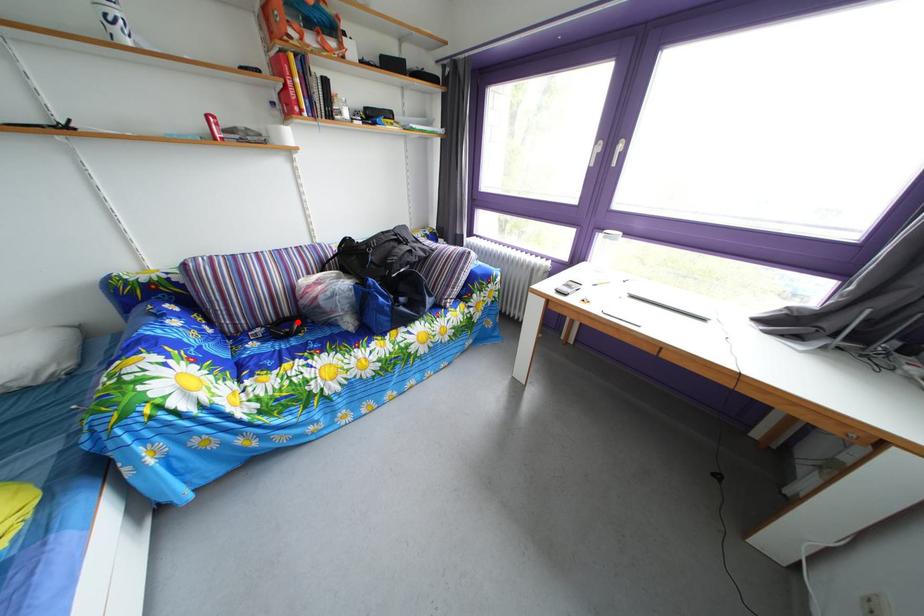
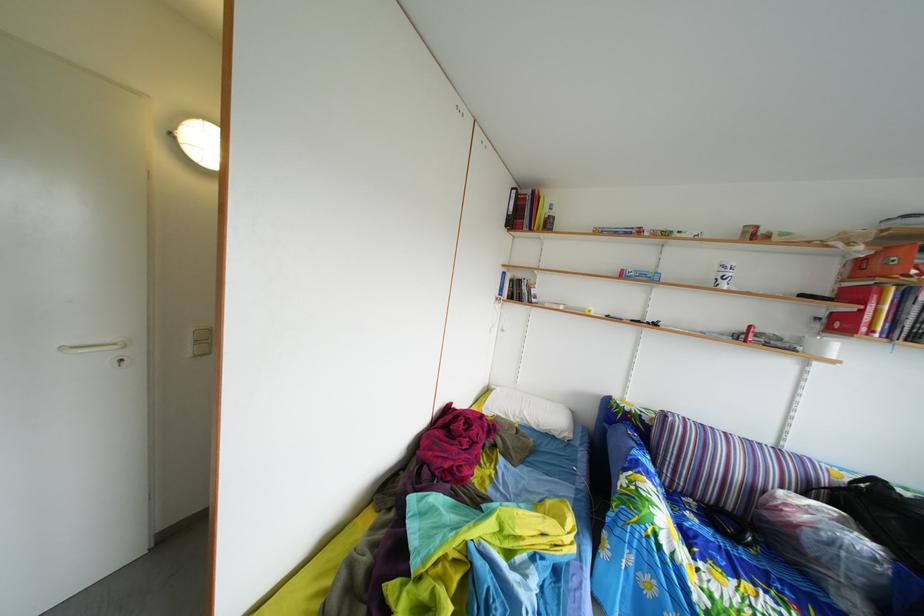
Where in the second image is the point corresponding to the highlighted location from the first image?

(739, 516)